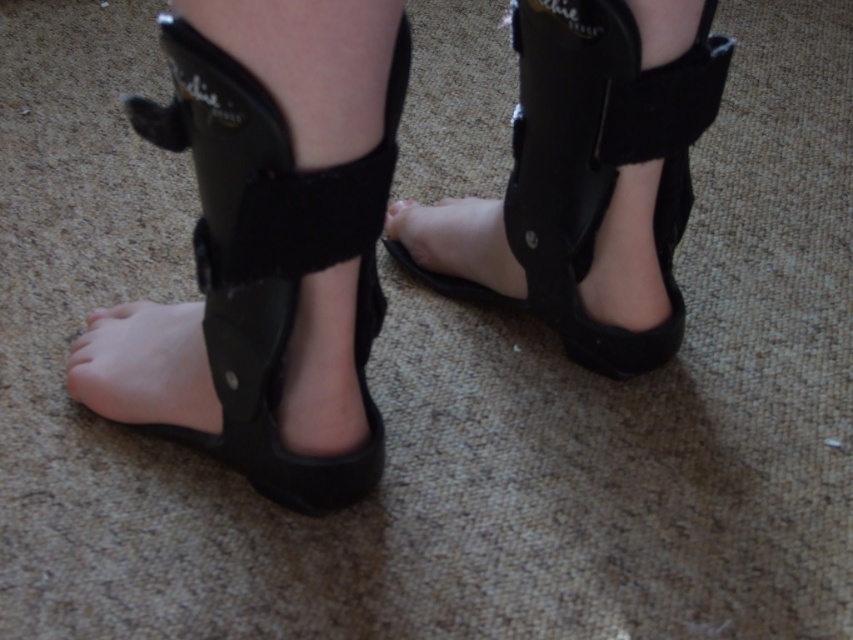
Is black suede foot at center wider than matte black toe at center?

Indeed, black suede foot at center has a greater width compared to matte black toe at center.

The width and height of the screenshot is (853, 640). Describe the element at coordinates (573, 273) in the screenshot. I see `black suede foot at center` at that location.

Where is `black suede foot at center`? black suede foot at center is located at coordinates (573, 273).

Can you confirm if black suede sandal at lower left is smaller than black suede foot at center?

No, black suede sandal at lower left is not smaller than black suede foot at center.

Is black suede sandal at lower left closer to camera compared to black suede foot at center?

That is True.

Image resolution: width=853 pixels, height=640 pixels. What do you see at coordinates (270, 259) in the screenshot? I see `black suede sandal at lower left` at bounding box center [270, 259].

Locate an element on the screen. black suede sandal at lower left is located at coordinates (270, 259).

Is black suede ankle brace at lower left positioned in front of black suede foot at center?

Yes.

Between black suede ankle brace at lower left and black suede foot at center, which one is positioned lower?

Positioned lower is black suede ankle brace at lower left.

Is point (368, 284) in front of point (666, 273)?

Yes, point (368, 284) is in front of point (666, 273).

The height and width of the screenshot is (640, 853). Identify the location of black suede ankle brace at lower left. (234, 388).